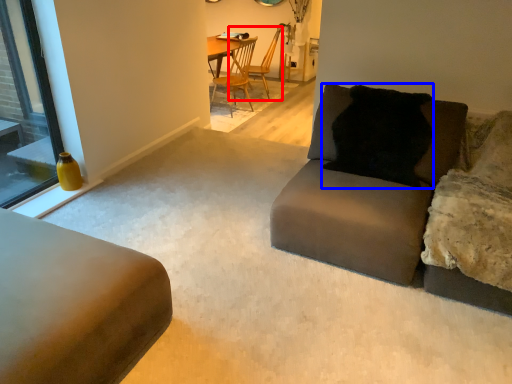
Question: Which point is further to the camera, chair (highlighted by a red box) or pillow (highlighted by a blue box)?

Choices:
 (A) chair
 (B) pillow

Answer: (A)